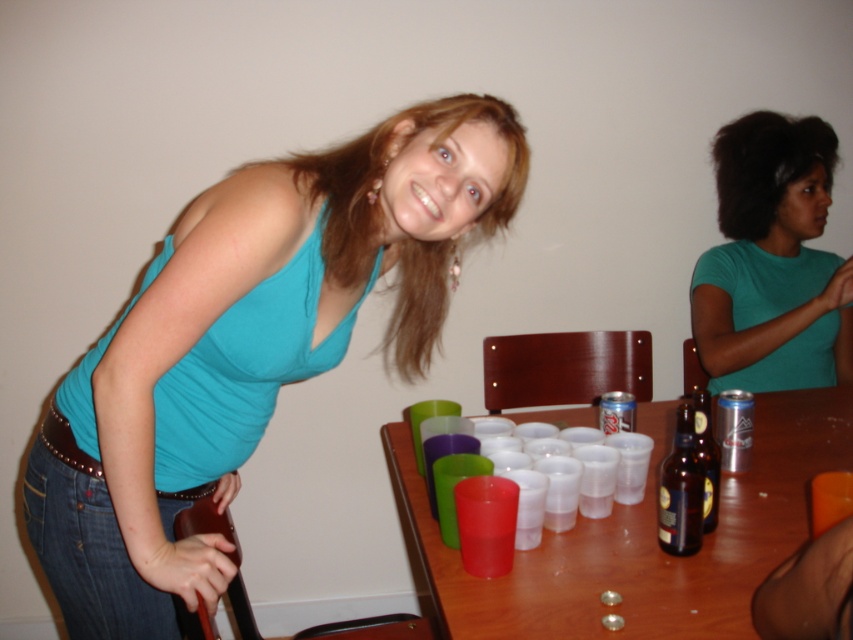
You are at a party and want to grab a drink. You see the translucent plastic cups at center and the brown glass bottle at lower right. Which one is closer to the edge of the table?

The translucent plastic cups at center are closer to the edge of the table than the brown glass bottle at lower right because the cups are positioned below the bottle, meaning they are further out towards the table edge.

Where is the green matte shirt at upper right located in the image?

The green matte shirt at upper right is located at the 2D coordinates point (772, 260) in the image.